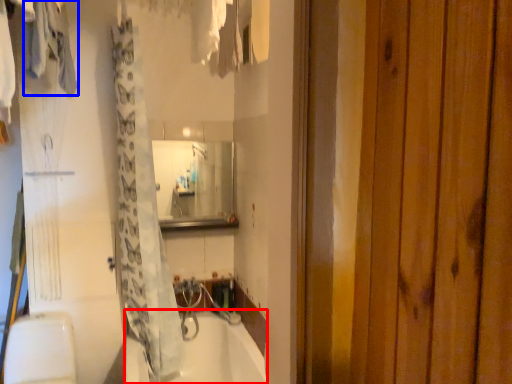
Question: Which object appears closest to the camera in this image, bathtub (highlighted by a red box) or clothing (highlighted by a blue box)?

Choices:
 (A) bathtub
 (B) clothing

Answer: (B)